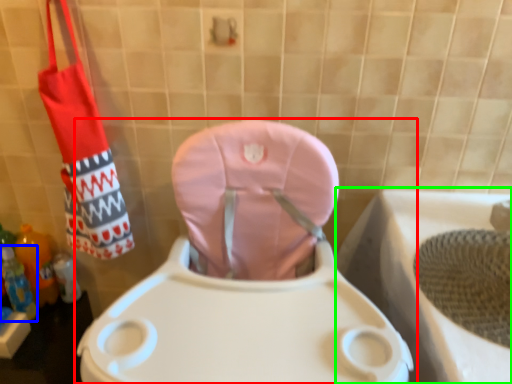
Question: Which object is positioned farthest from toilet (highlighted by a red box)? Select from bottle (highlighted by a blue box) and bath (highlighted by a green box).

Choices:
 (A) bottle
 (B) bath

Answer: (A)